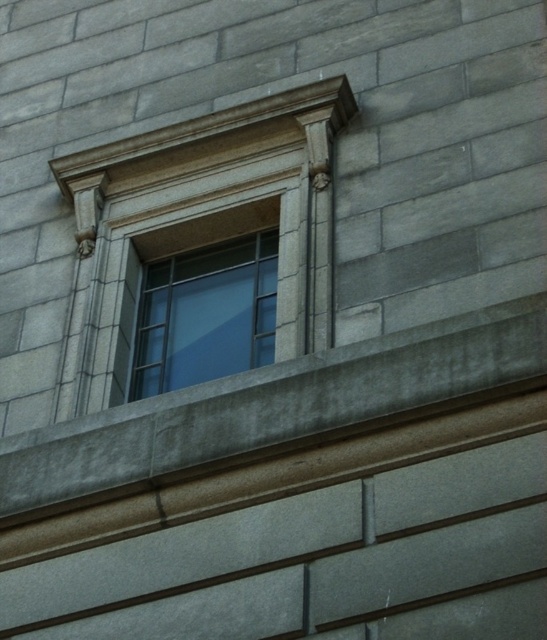
Between gray stone ledge at center and clear glass window at center, which one is positioned higher?

clear glass window at center

Between point (463, 380) and point (142, 374), which one is positioned in front?

Point (463, 380) is more forward.

Locate an element on the screen. The height and width of the screenshot is (640, 547). gray stone ledge at center is located at coordinates pos(282,412).